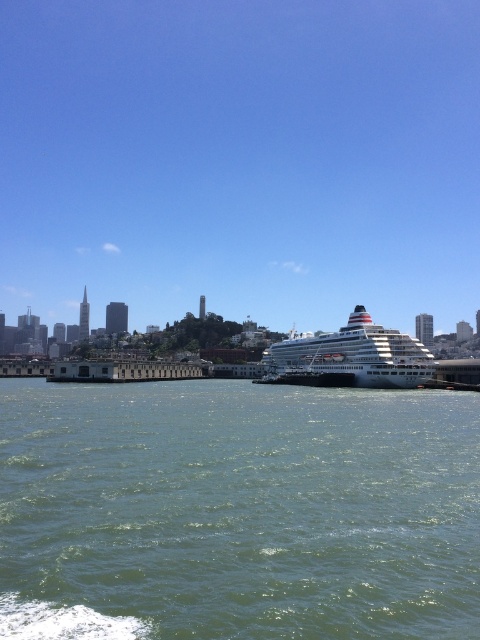
You are standing at the waterfront and want to locate two specific points in the image. The first point is at coordinates point (230, 456), and the second is at point (266, 376). Which point is closer to you?

Point (230, 456) is in front of point (266, 376), so the first point is closer to you.

You are a passenger on the white glossy cruise ship at center and want to jump into the water. Which direction should you go to reach the green water at center?

The green water at center is located below the white glossy cruise ship at center, so you should jump downward to reach the green water at center.